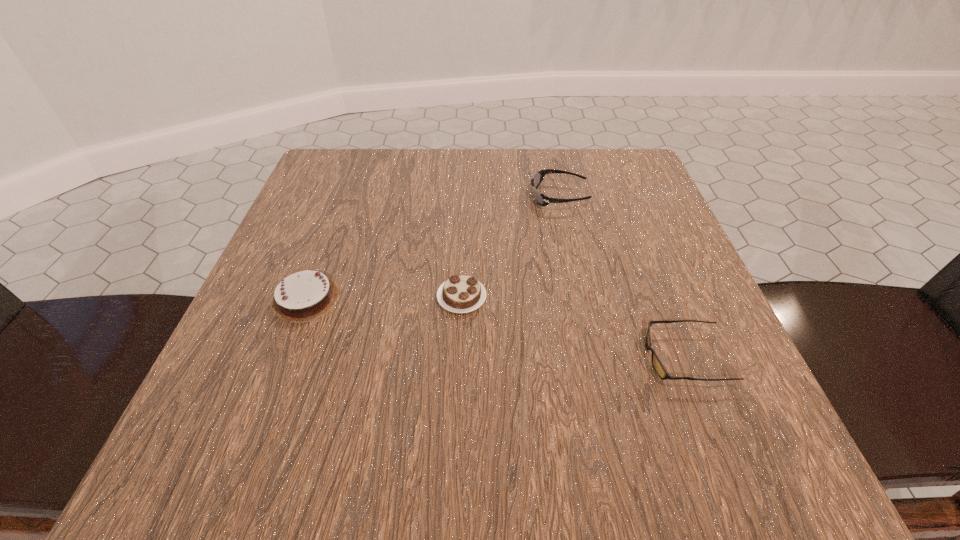
This screenshot has width=960, height=540. Find the location of `free location located on the front-facing side of the shorter sunglasses`. free location located on the front-facing side of the shorter sunglasses is located at coordinates 404,357.

I want to click on vacant space located on the front-facing side of the shorter sunglasses, so click(x=528, y=357).

Locate an element on the screen. The height and width of the screenshot is (540, 960). free space located 0.320m on the right of the left chocolate cake is located at coordinates (535, 298).

What are the coordinates of `free region located on the left of the third object from right to left` in the screenshot? It's located at (273, 298).

In order to click on object that is at the far edge in this screenshot , I will do `click(542, 200)`.

Identify the location of object that is at the left edge. This screenshot has width=960, height=540. (306, 295).

The height and width of the screenshot is (540, 960). What are the coordinates of `object that is positioned at the far right corner` in the screenshot? It's located at (542, 200).

The height and width of the screenshot is (540, 960). Find the location of `free space at the far edge of the desktop`. free space at the far edge of the desktop is located at coordinates [519, 209].

You are a GUI agent. You are given a task and a screenshot of the screen. Output one action in this format:
    pyautogui.click(x=<x>, y=<y>)
    Task: Click on the free location at the near edge of the desktop
    
    Given the screenshot: What is the action you would take?
    pyautogui.click(x=382, y=425)

This screenshot has width=960, height=540. What are the coordinates of `vacant space at the left edge` in the screenshot? It's located at pyautogui.click(x=354, y=210).